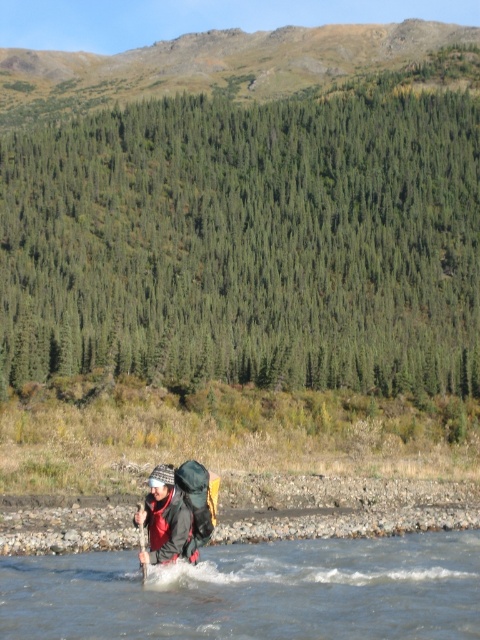
You are a hiker who needs to retrieve your wooden paddle at center from under your matte black backpack at center. Can you reach it without moving the backpack?

The matte black backpack at center is in front of the wooden paddle at center, so it is blocking access to the paddle. You will need to move the backpack to retrieve the paddle.

You are the person in the image. You want to place your matte black backpack at center on the ground without it getting wet. Can you put it on the clear water at center?

The clear water at center is below the matte black backpack at center, so placing the matte black backpack at center on the ground would require placing it on the clear water at center, which would get it wet. Therefore, you cannot place it there without it getting wet.

You are planning to pack your gear for a short hike. You have a matte black backpack at center and a wooden paddle at center. Which item can you fit into a smaller storage compartment?

The matte black backpack at center occupies less space than the wooden paddle at center, so it can fit into a smaller storage compartment.